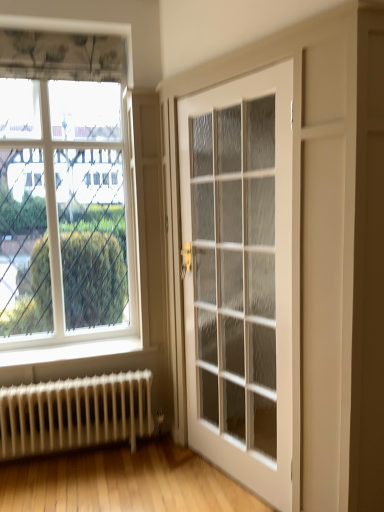
Find the location of a particular element. This screenshot has width=384, height=512. vacant area situated below white glossy door at center (from a real-world perspective) is located at coordinates (228, 478).